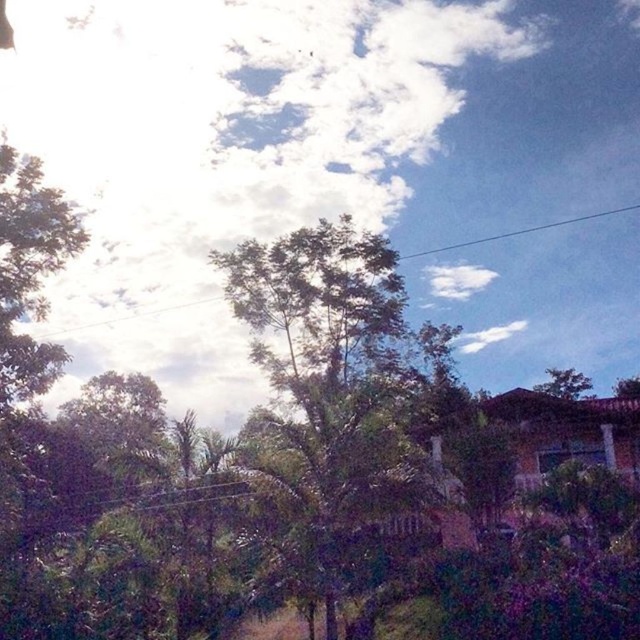
Question: Which object is farther from the camera taking this photo?

Choices:
 (A) green leafy tree at upper right
 (B) green leafy tree at center
 (C) white fluffy cloud at upper center

Answer: (A)

Question: Among these objects, which one is nearest to the camera?

Choices:
 (A) white fluffy cloud at upper center
 (B) green leafy tree at upper right

Answer: (A)

Question: Is white fluffy cloud at upper center bigger than green leafy tree at center?

Choices:
 (A) no
 (B) yes

Answer: (B)

Question: Is white fluffy cloud at upper center above green leafy tree at center?

Choices:
 (A) yes
 (B) no

Answer: (A)

Question: Among these points, which one is farthest from the camera?

Choices:
 (A) (106, 173)
 (B) (582, 392)

Answer: (A)

Question: Does green leafy tree at center come in front of green leafy tree at upper right?

Choices:
 (A) yes
 (B) no

Answer: (A)